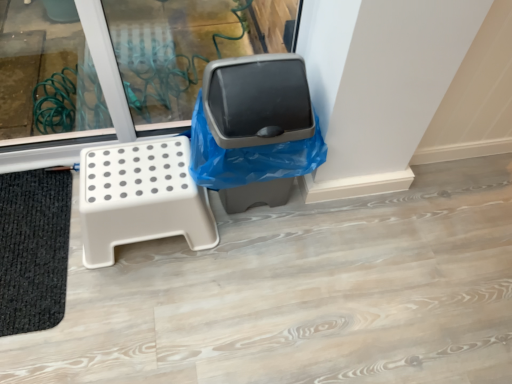
The image size is (512, 384). I want to click on vacant area located to the right-hand side of matte plastic trash can at center, so click(x=338, y=230).